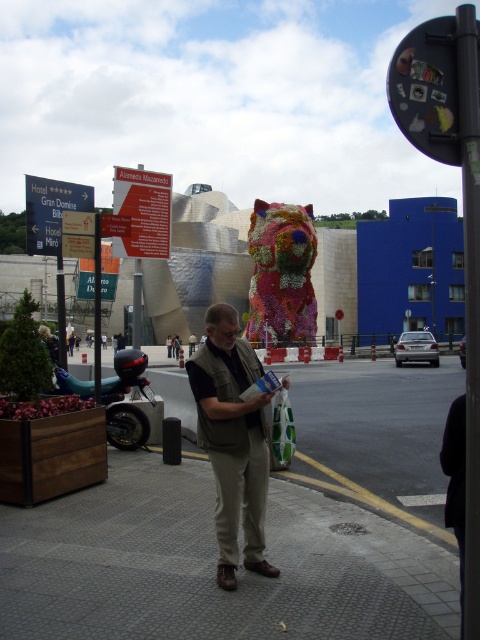
Can you confirm if gray textured pavement at center is wider than fluffy fabric dog at center?

No, gray textured pavement at center is not wider than fluffy fabric dog at center.

Is gray textured pavement at center above fluffy fabric dog at center?

Actually, gray textured pavement at center is below fluffy fabric dog at center.

This screenshot has height=640, width=480. I want to click on gray textured pavement at center, so click(214, 564).

The width and height of the screenshot is (480, 640). What are the coordinates of `gray textured pavement at center` in the screenshot? It's located at (214, 564).

Is point (168, 532) more distant than point (226, 531)?

That is True.

Image resolution: width=480 pixels, height=640 pixels. Identify the location of gray textured pavement at center. (214, 564).

Which is more to the left, khaki cotton vest at center or fluffy fabric dog at center?

From the viewer's perspective, khaki cotton vest at center appears more on the left side.

Does khaki cotton vest at center have a greater height compared to fluffy fabric dog at center?

No, khaki cotton vest at center is not taller than fluffy fabric dog at center.

What do you see at coordinates (232, 440) in the screenshot? The image size is (480, 640). I see `khaki cotton vest at center` at bounding box center [232, 440].

Locate an element on the screen. The height and width of the screenshot is (640, 480). khaki cotton vest at center is located at coordinates (232, 440).